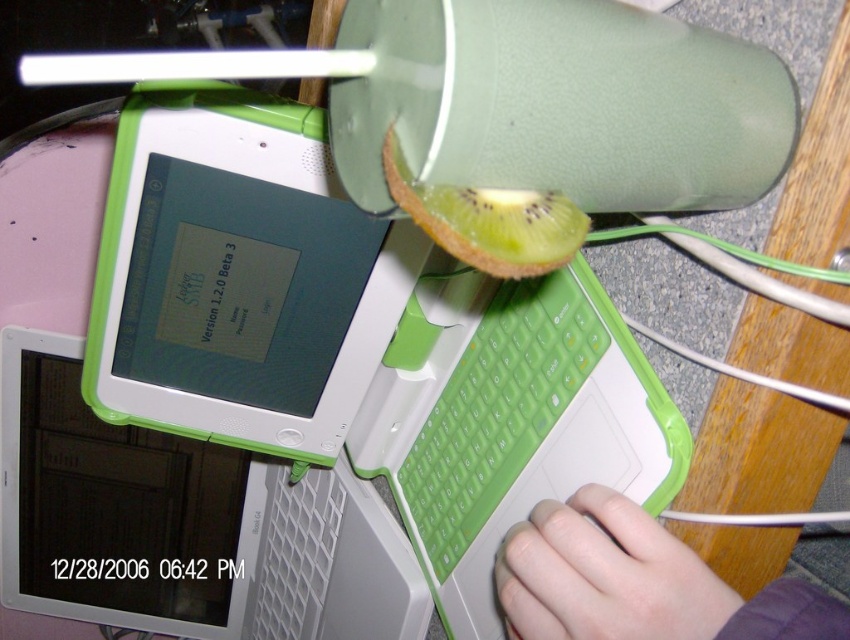
You are a software developer working on the laptop. You need to reach for the keyboard while keeping your hand on the desk. Which object is closer to you between the smooth skin hand at lower right and the green rubberized keyboard at center?

The smooth skin hand at lower right is closer to you since it is shorter than the green rubberized keyboard at center, meaning it is positioned nearer in the image.

You are a delivery robot that needs to place a package on the desk without blocking the camera. The package is 16 inches long. Is there enough space between the green plastic laptop at center and the camera to place the package?

The distance between the green plastic laptop at center and the camera is 15.75 inches. Since the package is 16 inches long, it would not fit in the available space.